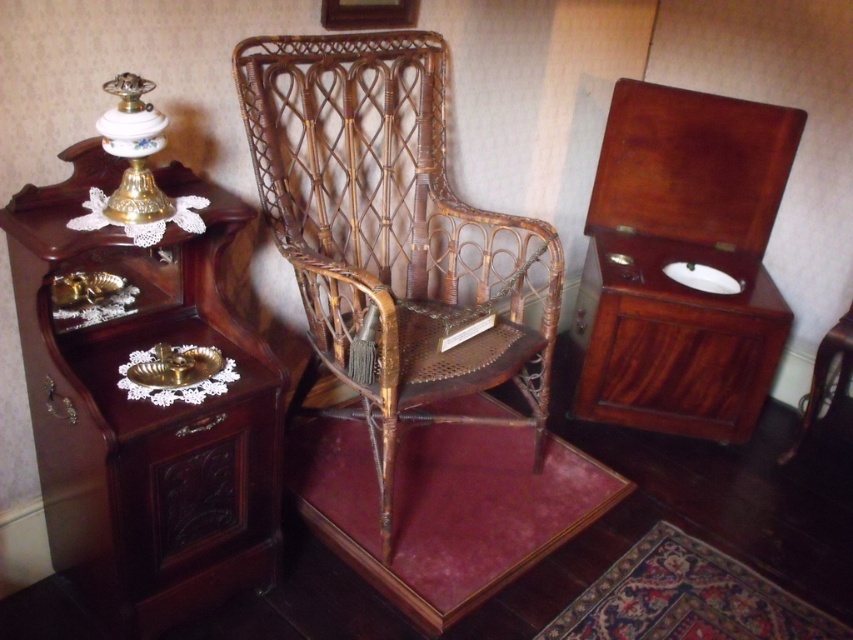
Question: Can you confirm if mahogany wood side table at left is bigger than woven brown cane chair at center?

Choices:
 (A) yes
 (B) no

Answer: (B)

Question: Can you confirm if mahogany wood side table at left is bigger than woven brown cane chair at center?

Choices:
 (A) yes
 (B) no

Answer: (B)

Question: Observing the image, what is the correct spatial positioning of mahogany wood side table at left in reference to woven brown cane chair at center?

Choices:
 (A) right
 (B) left

Answer: (B)

Question: Which of the following is the farthest from the observer?

Choices:
 (A) (332, 186)
 (B) (56, 545)

Answer: (A)